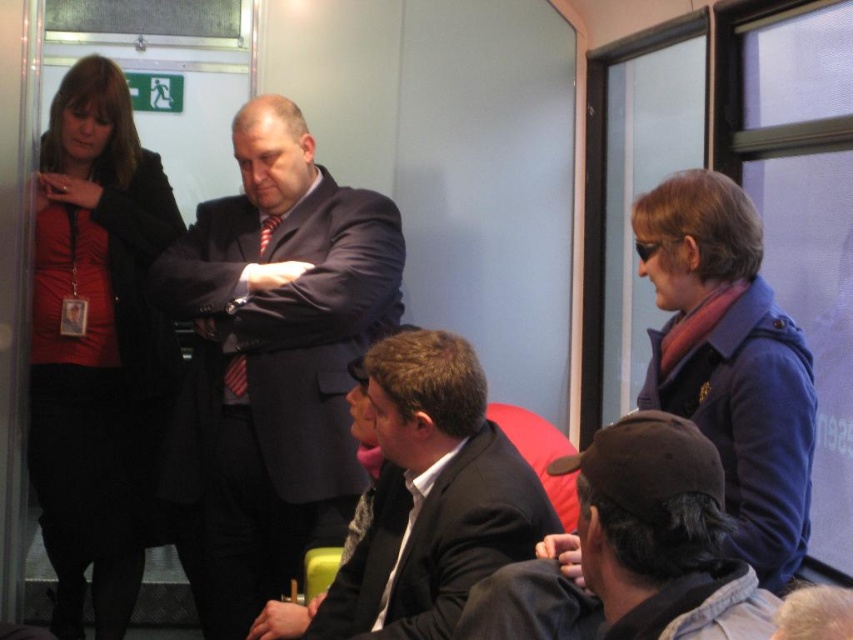
Question: Which point is closer to the camera?

Choices:
 (A) matte black suit at center
 (B) dark brown leather cap at lower right

Answer: (B)

Question: Does matte black suit at center appear under dark brown leather cap at lower right?

Choices:
 (A) no
 (B) yes

Answer: (B)

Question: Is dark blue suit at center positioned in front of matte black jacket at left?

Choices:
 (A) yes
 (B) no

Answer: (A)

Question: Among these objects, which one is farthest from the camera?

Choices:
 (A) dark blue suit at center
 (B) matte black jacket at left
 (C) matte black suit at center
 (D) dark brown leather cap at lower right

Answer: (B)

Question: Is matte black jacket at left thinner than dark brown leather cap at lower right?

Choices:
 (A) yes
 (B) no

Answer: (B)

Question: Which point is farther to the camera?

Choices:
 (A) matte black suit at center
 (B) matte black jacket at left
 (C) dark brown leather cap at lower right

Answer: (B)